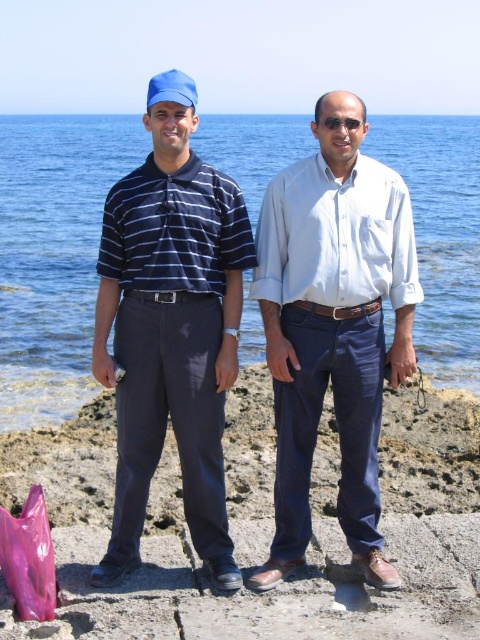
You are a photographer trying to capture a clear shot of both the matte blue cap at center and the white cotton shirt at center. Since you want to ensure both are visible in the frame, which object should you focus on first to account for their sizes?

The matte blue cap at center is smaller than the white cotton shirt at center, so you should focus on the matte blue cap at center first to ensure its details are clear before adjusting the focus for the larger white cotton shirt at center.

You are a photographer trying to capture the scene from the shore. You notice the matte blue cap at center and the white cotton shirt at center. Which object should you focus on first if you want to ensure both are in focus without adjusting the camera settings?

The matte blue cap at center is below the white cotton shirt at center, so focusing on the white cotton shirt at center first would ensure both are within the depth of field since it is higher up and closer to the cap.